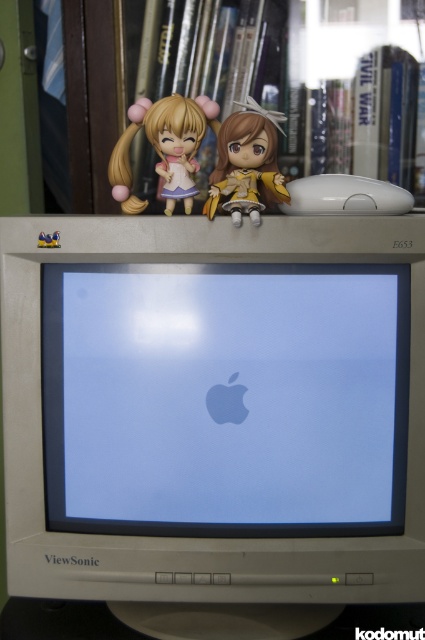
You are setting up a new desk and want to place both the beige plastic monitor at center and the matte yellow doll at center on a shelf. The shelf is exactly 1 meter wide. Based on their widths, can both items fit side by side without overlapping?

The beige plastic monitor at center might be wider than matte yellow doll at center. If the monitor is wider, the combined width of both items could exceed the shelf width of 1 meter, so they might not fit. If the monitor is narrower, they might fit. However, since the exact widths aren

In the scene shown: You are setting up a new desk and want to place a small decorative item on the shelf above your computer monitor. Given the current setup shown in the image, which object would you choose between the beige plastic monitor at center and the matte plastic figurine at upper center to place the item on top of?

The beige plastic monitor at center is bigger than the matte plastic figurine at upper center, so you should place the decorative item on top of the beige plastic monitor at center since it has a larger surface area to support the item.

You are setting up a desk and want to place the beige plastic monitor at center and the matte yellow doll at center on a shelf. Since you want the monitor to be visible from a distance, which object should you place higher up?

The beige plastic monitor at center has a greater height compared to the matte yellow doll at center, so placing it higher up will ensure it remains visible from a distance.